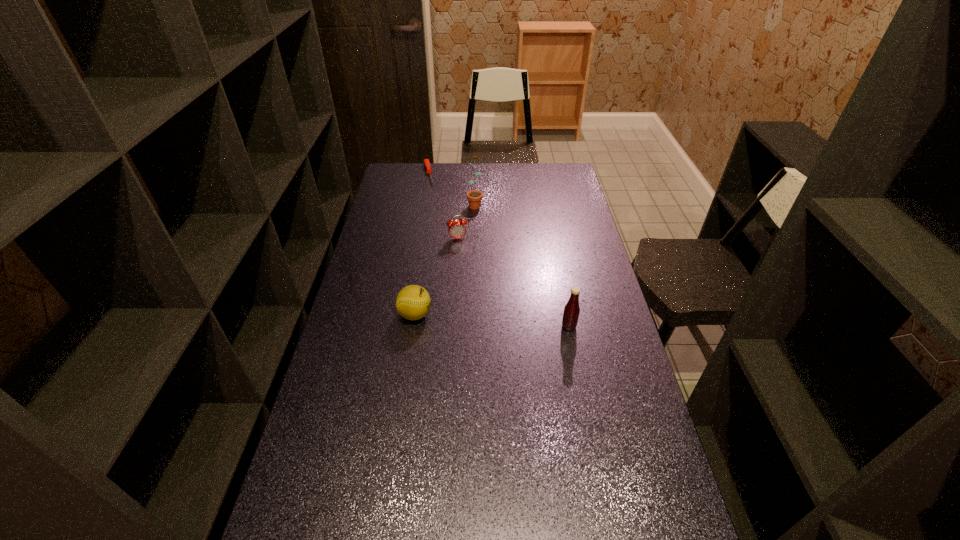
The width and height of the screenshot is (960, 540). I want to click on free space between the rightmost object and the tallest object, so point(521,265).

At what (x,y) coordinates should I click in order to perform the action: click on free space that is in between the third nearest object and the rightmost object. Please return your answer as a coordinate pair (x, y). Looking at the image, I should click on 514,282.

Find the location of a particular element. This screenshot has width=960, height=540. vacant area that lies between the second tallest object and the softball is located at coordinates coord(492,320).

The image size is (960, 540). What are the coordinates of `free space that is in between the softball and the farthest object` in the screenshot? It's located at (421, 244).

At what (x,y) coordinates should I click in order to perform the action: click on vacant area that lies between the farthest object and the alarm clock. Please return your answer as a coordinate pair (x, y). This screenshot has height=540, width=960. Looking at the image, I should click on (444, 206).

You are a GUI agent. You are given a task and a screenshot of the screen. Output one action in this format:
    pyautogui.click(x=<x>, y=<y>)
    Task: Click on the empty location between the sunflower and the rightmost object
    
    Given the screenshot: What is the action you would take?
    pyautogui.click(x=521, y=265)

Identify which object is located as the third nearest to the fourth shortest object. Please provide its 2D coordinates. Your answer should be formatted as a tuple, i.e. [(x, y)], where the tuple contains the x and y coordinates of a point satisfying the conditions above.

[(474, 197)]

Image resolution: width=960 pixels, height=540 pixels. What are the coordinates of `the closest object to the farthest object` in the screenshot? It's located at point(474,197).

Where is `vacant space that satisfies the following two spatial constraints: 1. on the front side of the screwdriver; 2. on the logo side of the softball`? This screenshot has height=540, width=960. vacant space that satisfies the following two spatial constraints: 1. on the front side of the screwdriver; 2. on the logo side of the softball is located at coordinates (404, 314).